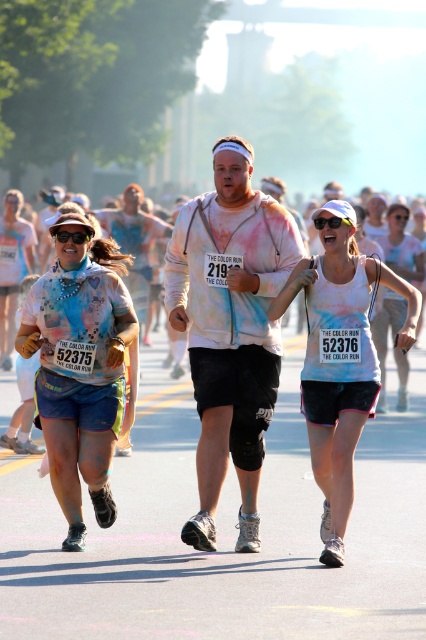
You are a photographer at the event and want to capture a photo of the matte blue shorts at left and the black plastic goggles at upper center in the same frame. Based on their positions, which object should you focus on first to ensure both are in focus?

The matte blue shorts at left are wider than the black plastic goggles at upper center, so you should focus on the matte blue shorts at left first to ensure both are in focus.